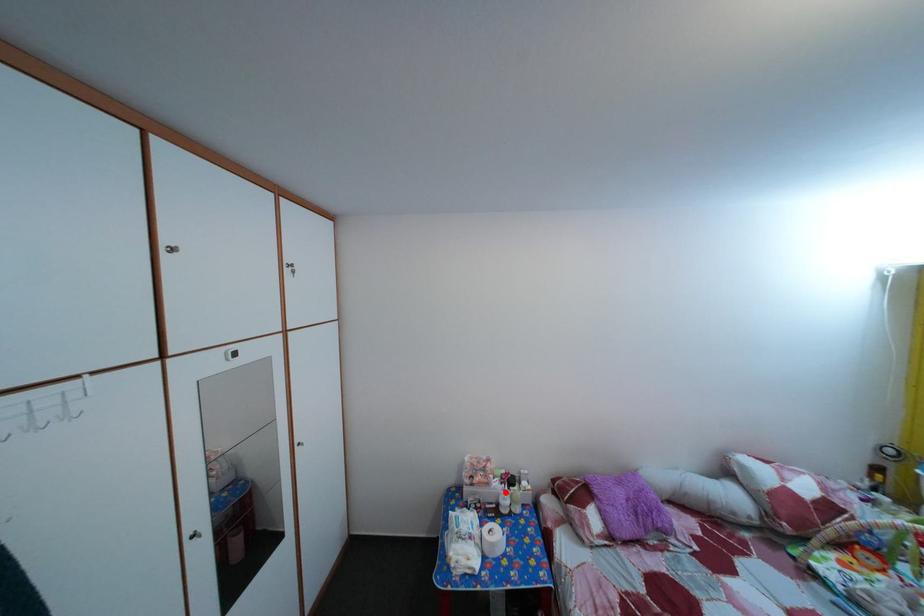
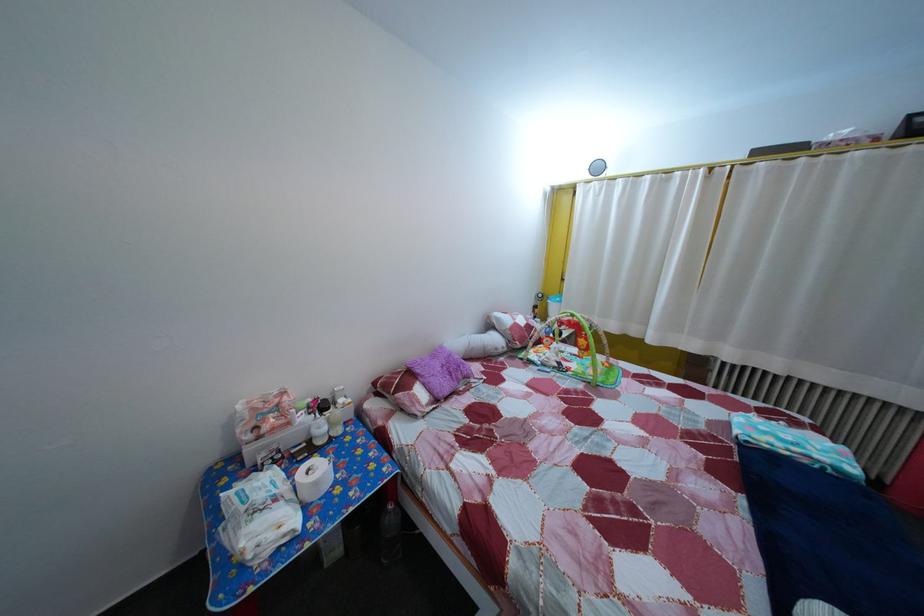
Question: I am providing you with two images of the same scene from different viewpoints. Image1 has a red point marked. In image2, the corresponding 3D location appears at what relative position? Reply with the corresponding letter.

Choices:
 (A) Closer
 (B) Farther

Answer: (A)